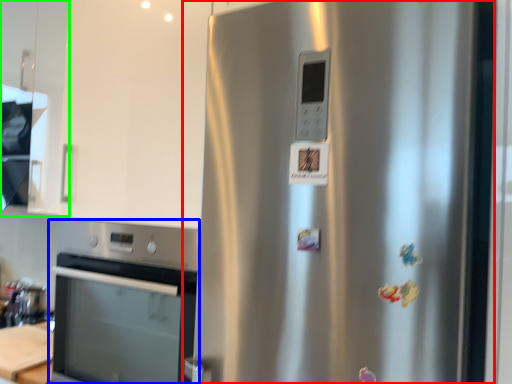
Question: Based on their relative distances, which object is nearer to refrigerator (highlighted by a red box)? Choose from home appliance (highlighted by a blue box) and cabinetry (highlighted by a green box).

Choices:
 (A) home appliance
 (B) cabinetry

Answer: (A)